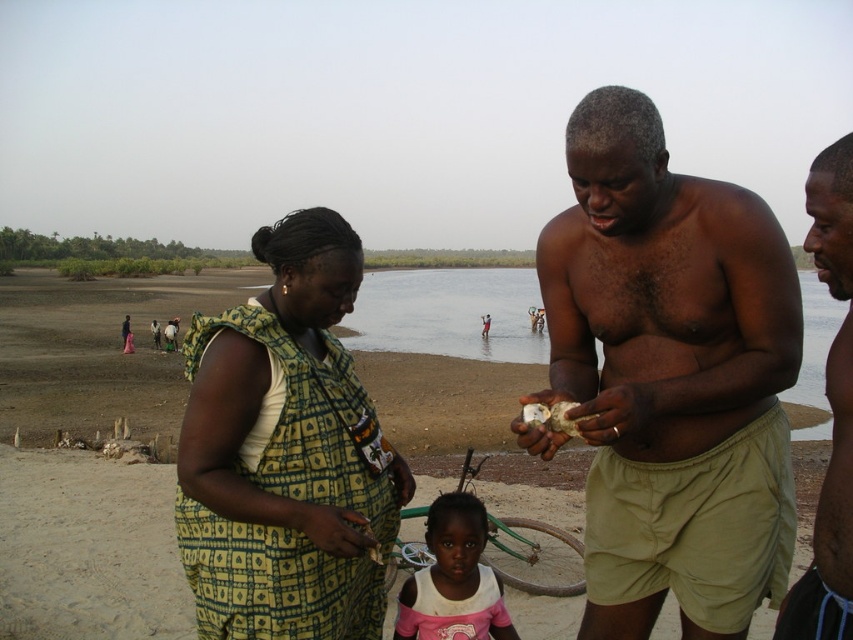
Which of these two, skinny tan torso at center or sandy beach at center, stands taller?

With more height is sandy beach at center.

Does skinny tan torso at center have a lesser height compared to sandy beach at center?

Indeed, skinny tan torso at center has a lesser height compared to sandy beach at center.

Between point (698, 419) and point (51, 547), which one is positioned behind?

The point (51, 547) is more distant.

Locate an element on the screen. Image resolution: width=853 pixels, height=640 pixels. skinny tan torso at center is located at coordinates (671, 376).

Between green printed fabric dress at left and pink cotton shirt at center, which one appears on the right side from the viewer's perspective?

From the viewer's perspective, pink cotton shirt at center appears more on the right side.

Does green printed fabric dress at left appear over pink cotton shirt at center?

Yes.

Is point (357, 264) in front of point (461, 545)?

Yes, it is.

This screenshot has height=640, width=853. What are the coordinates of `green printed fabric dress at left` in the screenshot? It's located at (285, 452).

Does skinny tan torso at center have a larger size compared to shiny black skin at center?

No.

Is skinny tan torso at center to the right of shiny black skin at center from the viewer's perspective?

Incorrect, skinny tan torso at center is not on the right side of shiny black skin at center.

Who is more distant from viewer, (643,484) or (817,572)?

The point (643,484) is behind.

Identify the location of skinny tan torso at center. (671, 376).